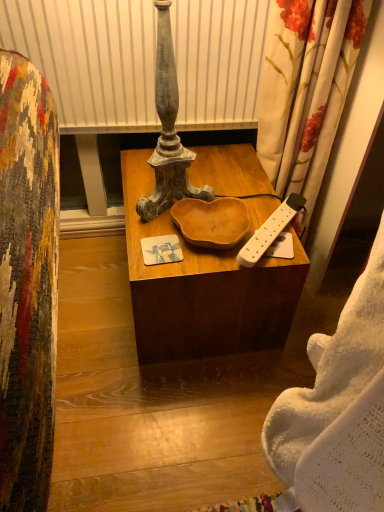
Question: Is white plastic remote control at right wider or thinner than white knitted blanket at right?

Choices:
 (A) thin
 (B) wide

Answer: (A)

Question: From a real-world perspective, is white plastic remote control at right positioned above or below white knitted blanket at right?

Choices:
 (A) above
 (B) below

Answer: (B)

Question: Estimate the real-world distances between objects in this image. Which object is farther from the white plastic remote control at right?

Choices:
 (A) white knitted blanket at right
 (B) wooden bowl at center

Answer: (A)

Question: Which of these objects is positioned farthest from the white knitted blanket at right?

Choices:
 (A) wooden bowl at center
 (B) white plastic remote control at right

Answer: (A)